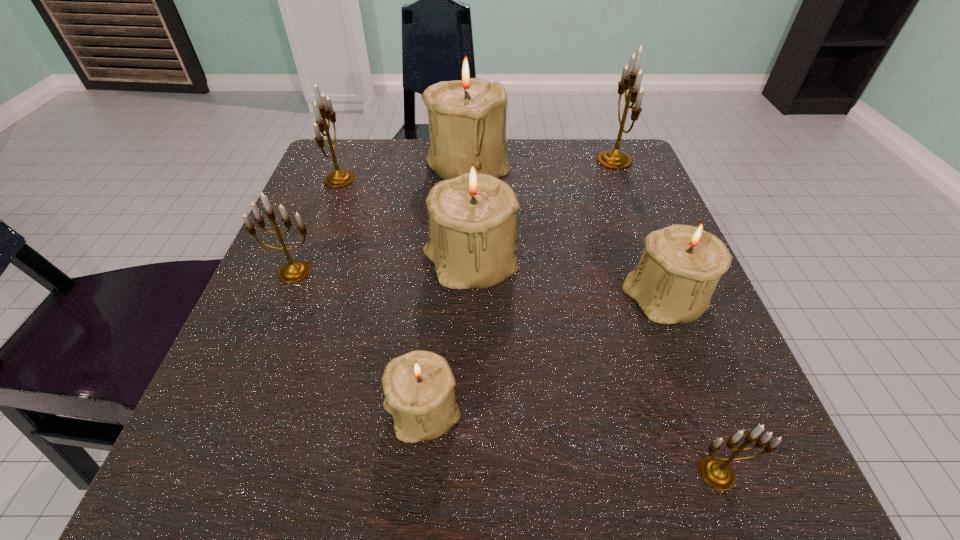
Image resolution: width=960 pixels, height=540 pixels. I want to click on vacant region between the biggest gold candelabrum and the farthest beige candle_holder, so click(x=541, y=162).

Find the location of a particular element. free area in between the smallest beige candle_holder and the biggest gold candelabrum is located at coordinates (518, 287).

This screenshot has width=960, height=540. In order to click on free space between the third farthest gold candelabrum and the smallest beige candle_holder in this screenshot , I will do `click(358, 342)`.

Image resolution: width=960 pixels, height=540 pixels. Find the location of `free spot between the second smallest gold candelabrum and the third smallest beige candle_holder`. free spot between the second smallest gold candelabrum and the third smallest beige candle_holder is located at coordinates (382, 268).

Locate an element on the screen. free space between the biggest beige candle_holder and the nearest candelabrum is located at coordinates (593, 319).

Image resolution: width=960 pixels, height=540 pixels. What are the coordinates of `free space between the second biggest beige candle_holder and the second biggest gold candelabrum` in the screenshot? It's located at (405, 221).

Locate an element on the screen. The width and height of the screenshot is (960, 540). vacant space in between the third biggest gold candelabrum and the nearest candelabrum is located at coordinates (506, 373).

Choose which object is the second nearest neighbor to the rightmost beige candle_holder. Please provide its 2D coordinates. Your answer should be formatted as a tuple, i.e. [(x, y)], where the tuple contains the x and y coordinates of a point satisfying the conditions above.

[(716, 472)]

At what (x,y) coordinates should I click in order to perform the action: click on object that stands as the seventh closest to the rightmost beige candle_holder. Please return your answer as a coordinate pair (x, y). The width and height of the screenshot is (960, 540). Looking at the image, I should click on (339, 178).

Locate which candelabrum is the closest to the second biggest gold candelabrum. Please provide its 2D coordinates. Your answer should be formatted as a tuple, i.e. [(x, y)], where the tuple contains the x and y coordinates of a point satisfying the conditions above.

[(468, 114)]